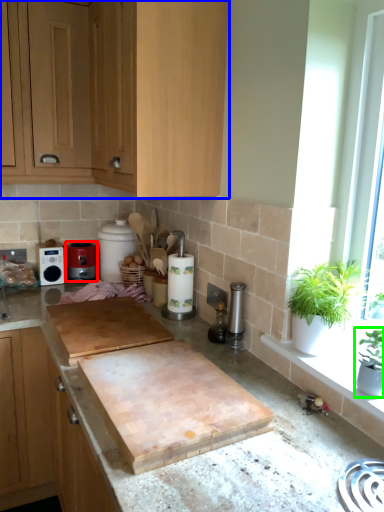
Question: Considering the real-world distances, which object is closest to kitchen appliance (highlighted by a red box)? cabinetry (highlighted by a blue box) or houseplant (highlighted by a green box).

Choices:
 (A) cabinetry
 (B) houseplant

Answer: (A)